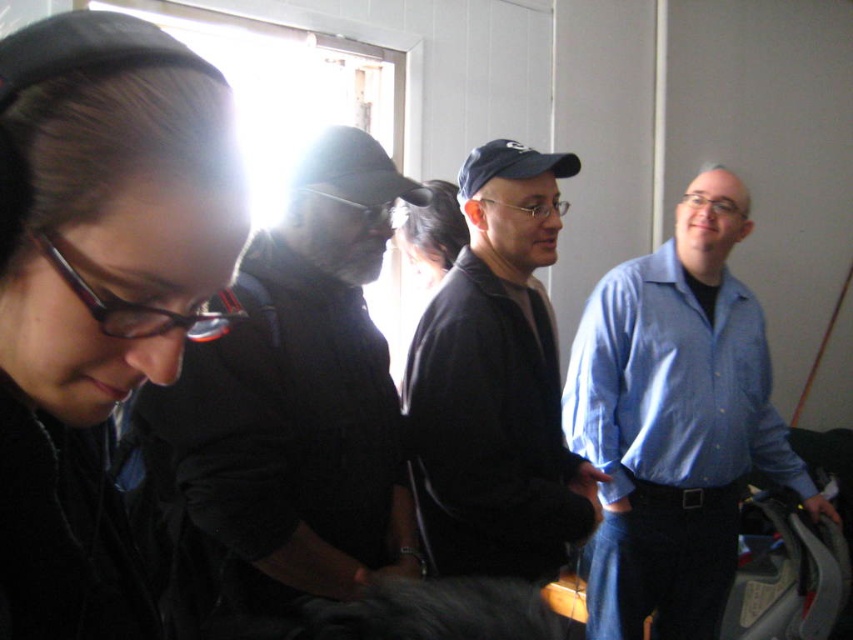
Is dark gray jacket at center smaller than blue shirt at right?

Yes.

Is point (338, 177) positioned in front of point (792, 460)?

Yes.

Where is `dark gray jacket at center`? The width and height of the screenshot is (853, 640). dark gray jacket at center is located at coordinates (283, 413).

Is point (289, 182) closer to viewer compared to point (544, 156)?

Yes, it is in front of point (544, 156).

Is black fabric baseball cap at center closer to camera compared to blue fabric baseball cap at center?

Yes.

In order to click on black fabric baseball cap at center in this screenshot , I will do `click(352, 168)`.

Between point (259, 500) and point (451, 189), which one is positioned behind?

Positioned behind is point (451, 189).

Who is positioned more to the right, dark gray jacket at center or dark brown hair at center?

Positioned to the right is dark brown hair at center.

From the picture: Who is more distant from viewer, (373, 408) or (409, 241)?

The point (409, 241) is behind.

The height and width of the screenshot is (640, 853). What are the coordinates of `dark gray jacket at center` in the screenshot? It's located at (283, 413).